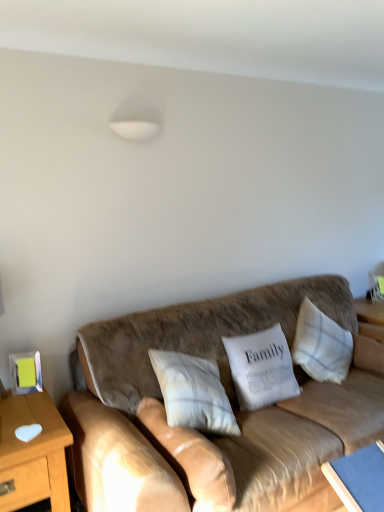
Question: Is white textured pillow at center, which is the 4th pillow in right-to-left order, behind blue fabric table at lower right, the first table viewed from the right?

Choices:
 (A) no
 (B) yes

Answer: (A)

Question: Can you confirm if white textured pillow at center, which is the 4th pillow in right-to-left order, is taller than blue fabric table at lower right, the first table viewed from the right?

Choices:
 (A) no
 (B) yes

Answer: (A)

Question: Considering the relative sizes of white textured pillow at center, arranged as the 1th pillow when viewed from the left, and blue fabric table at lower right, the first table viewed from the right, in the image provided, is white textured pillow at center, arranged as the 1th pillow when viewed from the left, thinner than blue fabric table at lower right, the first table viewed from the right,?

Choices:
 (A) yes
 (B) no

Answer: (A)

Question: Is white textured pillow at center, arranged as the 1th pillow when viewed from the left, next to blue fabric table at lower right, the second table from the left?

Choices:
 (A) yes
 (B) no

Answer: (B)

Question: Would you say blue fabric table at lower right, the first table viewed from the right, is part of white textured pillow at center, arranged as the 1th pillow when viewed from the left,'s contents?

Choices:
 (A) no
 (B) yes

Answer: (A)

Question: From a real-world perspective, is white textured pillow at center, which is the 4th pillow in right-to-left order, physically above blue fabric table at lower right, the first table viewed from the right?

Choices:
 (A) yes
 (B) no

Answer: (A)

Question: Is blue fabric table at lower right, the first table viewed from the right, at the left side of wooden table at left, the 2th table when ordered from right to left?

Choices:
 (A) no
 (B) yes

Answer: (A)

Question: Considering the relative positions of blue fabric table at lower right, the second table from the left, and wooden table at left, the 2th table when ordered from right to left, in the image provided, is blue fabric table at lower right, the second table from the left, to the right of wooden table at left, the 2th table when ordered from right to left, from the viewer's perspective?

Choices:
 (A) yes
 (B) no

Answer: (A)

Question: From the image's perspective, is blue fabric table at lower right, the second table from the left, on wooden table at left, the first table when ordered from left to right?

Choices:
 (A) no
 (B) yes

Answer: (A)

Question: Is blue fabric table at lower right, the first table viewed from the right, not inside wooden table at left, the first table when ordered from left to right?

Choices:
 (A) yes
 (B) no

Answer: (A)

Question: Can you confirm if blue fabric table at lower right, the second table from the left, is wider than wooden table at left, the 2th table when ordered from right to left?

Choices:
 (A) yes
 (B) no

Answer: (B)

Question: Is blue fabric table at lower right, the second table from the left, taller than wooden table at left, the first table when ordered from left to right?

Choices:
 (A) yes
 (B) no

Answer: (B)

Question: Is brown leather couch at center to the left of white fabric pillow at center, which ranks as the 2th pillow in right-to-left order, from the viewer's perspective?

Choices:
 (A) yes
 (B) no

Answer: (B)